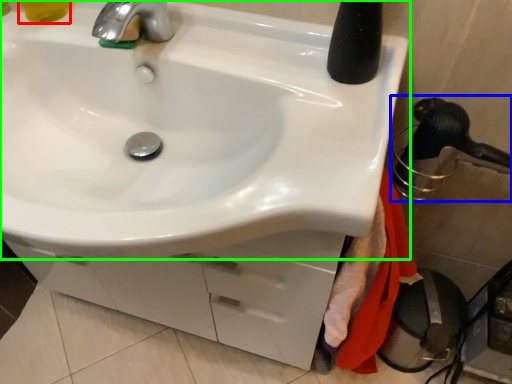
Question: Based on their relative distances, which object is farther from liquid (highlighted by a red box)? Choose from shower (highlighted by a blue box) and sink (highlighted by a green box).

Choices:
 (A) shower
 (B) sink

Answer: (A)